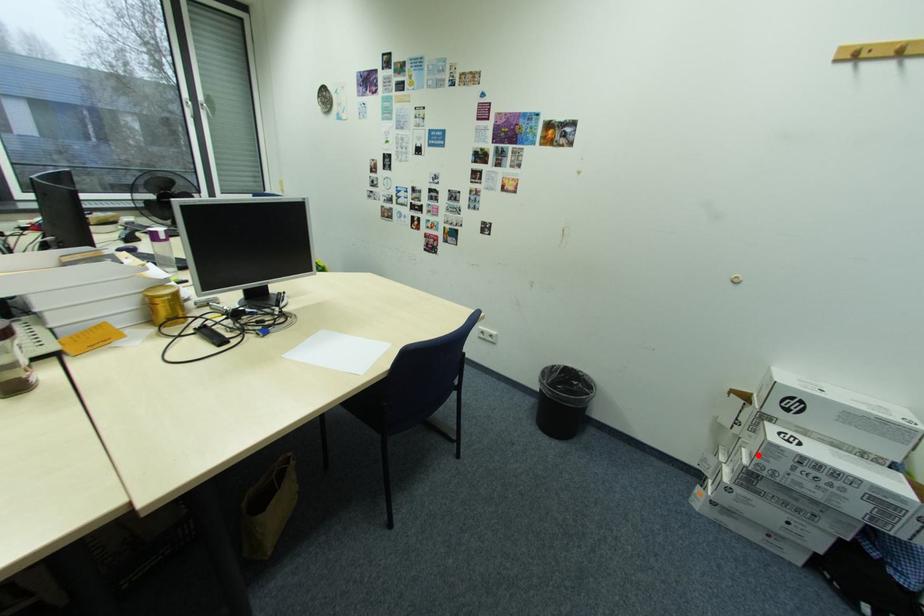
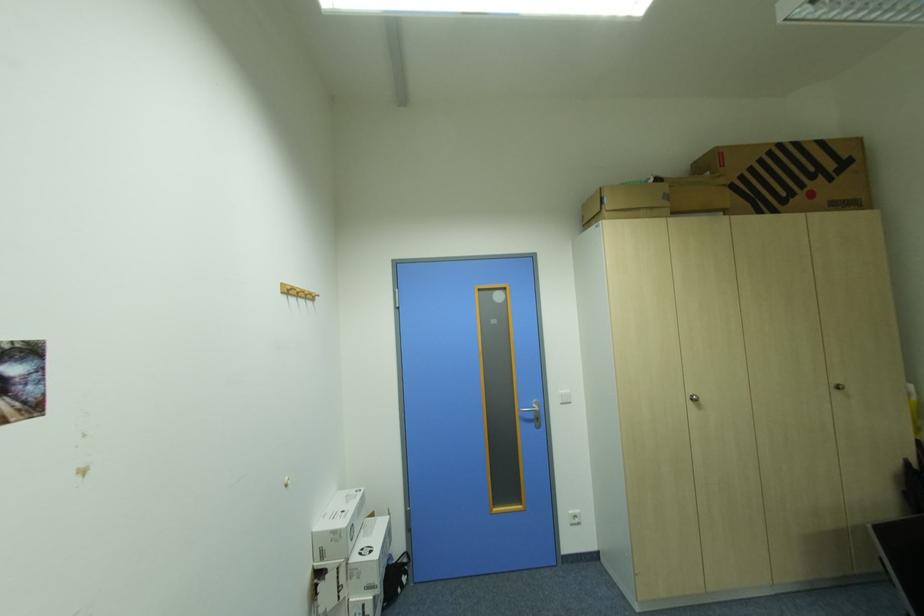
Locate, in the second image, the point that corresponds to the highlighted location in the first image.

(377, 590)